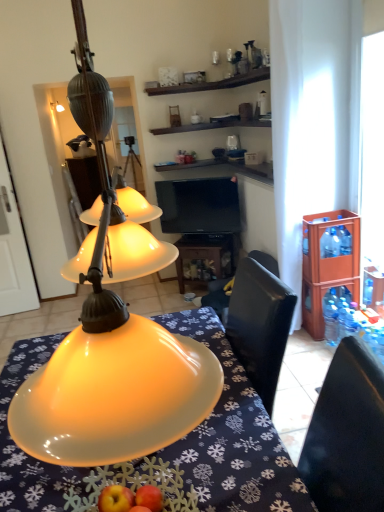
Question: Considering the positions of matte yellow lampshade at center and transparent plastic bottle at right, which is counted as the first bottle, starting from the bottom, in the image, is matte yellow lampshade at center taller or shorter than transparent plastic bottle at right, which is counted as the first bottle, starting from the bottom,?

Choices:
 (A) tall
 (B) short

Answer: (A)

Question: Relative to transparent plastic bottle at right, which is counted as the first bottle, starting from the bottom, is matte yellow lampshade at center in front or behind?

Choices:
 (A) behind
 (B) front

Answer: (B)

Question: Which object is positioned closest to the black glossy tv at center?

Choices:
 (A) matte yellow glass lampshade at center
 (B) clear plastic bottle at right, the 3th bottle positioned from the bottom
 (C) brown wooden cabinet at right
 (D) matte yellow lampshade at center
 (E) wooden table at center

Answer: (E)

Question: Considering the real-world distances, which object is closest to the matte yellow lampshade at center?

Choices:
 (A) brown wooden cabinet at right
 (B) clear plastic bottle at right, arranged as the 1th bottle when viewed from the top
 (C) matte yellow glass lampshade at center
 (D) wooden table at center
 (E) blue plastic bottles at right, the 2th bottle when ordered from top to bottom

Answer: (C)